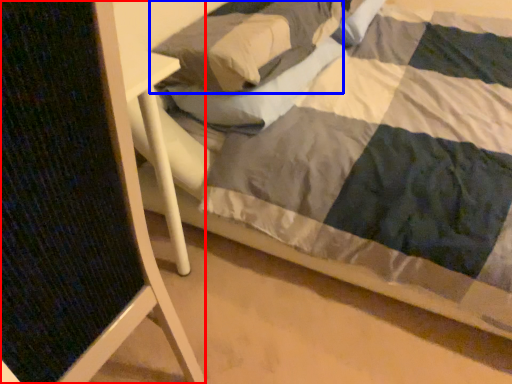
Question: Which object is further to the camera taking this photo, folding chair (highlighted by a red box) or pillow (highlighted by a blue box)?

Choices:
 (A) folding chair
 (B) pillow

Answer: (B)